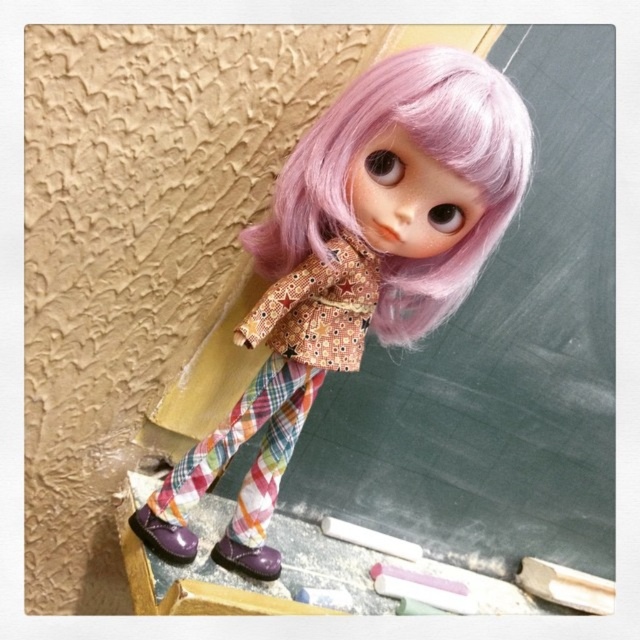
Question: Which point is closer to the camera?

Choices:
 (A) purple matte shoe at lower center
 (B) matte fabric doll at center
 (C) shiny purple shoe at lower left

Answer: (B)

Question: Is pastel pink wig at upper center thinner than shiny purple shoe at lower left?

Choices:
 (A) yes
 (B) no

Answer: (B)

Question: Which object is the closest to the matte fabric doll at center?

Choices:
 (A) pastel pink wig at upper center
 (B) shiny purple shoe at lower left
 (C) purple matte shoe at lower center

Answer: (A)

Question: Is matte fabric doll at center thinner than pastel pink wig at upper center?

Choices:
 (A) no
 (B) yes

Answer: (A)

Question: Estimate the real-world distances between objects in this image. Which object is closer to the pastel pink wig at upper center?

Choices:
 (A) shiny purple shoe at lower left
 (B) purple matte shoe at lower center
 (C) matte fabric doll at center

Answer: (C)

Question: Is the position of matte fabric doll at center more distant than that of pastel pink wig at upper center?

Choices:
 (A) yes
 (B) no

Answer: (A)